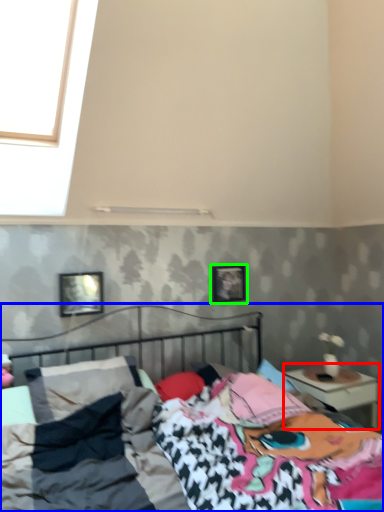
Question: Which is farther away from nightstand (highlighted by a red box)? bed (highlighted by a blue box) or picture frame (highlighted by a green box)?

Choices:
 (A) bed
 (B) picture frame

Answer: (A)